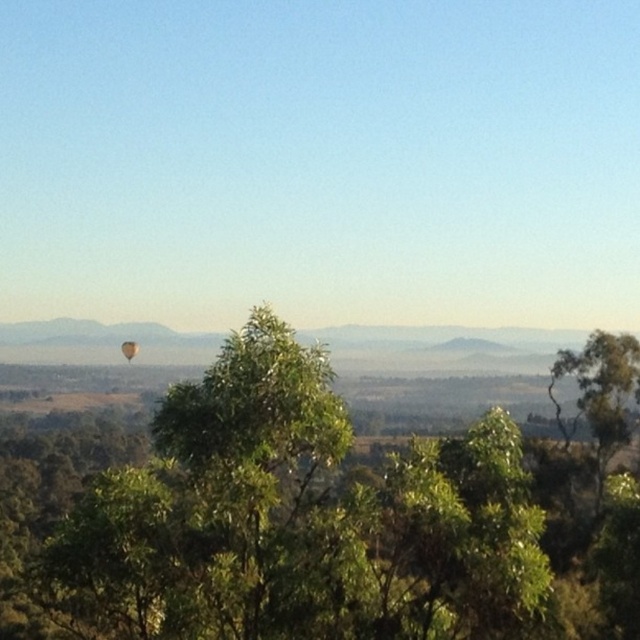
Question: Which of the following is the farthest from the observer?

Choices:
 (A) green leafy tree at center
 (B) green leafy tree at right
 (C) orange fabric hot air balloon at center

Answer: (C)

Question: Where is green leafy tree at center located in relation to orange fabric hot air balloon at center in the image?

Choices:
 (A) above
 (B) below

Answer: (B)

Question: Which point is farther from the camera taking this photo?

Choices:
 (A) [445, 486]
 (B) [134, 342]

Answer: (B)

Question: Does green leafy tree at center have a greater width compared to green leafy tree at right?

Choices:
 (A) yes
 (B) no

Answer: (A)

Question: Can you confirm if green leafy tree at center is positioned below green leafy tree at right?

Choices:
 (A) no
 (B) yes

Answer: (B)

Question: Which point is closer to the camera?

Choices:
 (A) (125, 348)
 (B) (198, 436)
 (C) (618, 348)

Answer: (B)